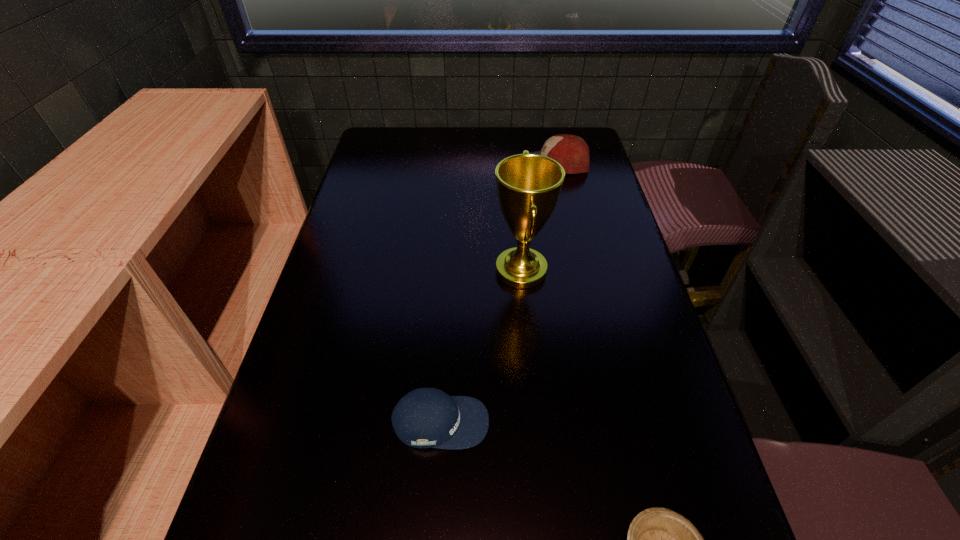
Locate an element on the screen. award is located at coordinates (528, 185).

Find the location of a particular element. Image resolution: width=960 pixels, height=540 pixels. the third nearest object is located at coordinates (528, 185).

The image size is (960, 540). What are the coordinates of `the right baseball cap` in the screenshot? It's located at (570, 151).

I want to click on the taller baseball cap, so click(x=570, y=151).

Where is `the shorter baseball cap`? This screenshot has width=960, height=540. the shorter baseball cap is located at coordinates (425, 417).

Find the location of a particular element. This screenshot has height=540, width=960. the nearer baseball cap is located at coordinates (425, 417).

Find the location of `vacant space located by the handles of the tallest object`. vacant space located by the handles of the tallest object is located at coordinates (409, 271).

Where is `vacant space situated 0.310m by the handles of the tallest object`? The width and height of the screenshot is (960, 540). vacant space situated 0.310m by the handles of the tallest object is located at coordinates (374, 271).

Find the location of a particular element. vacant region located 0.190m by the handles of the tallest object is located at coordinates (420, 271).

The image size is (960, 540). I want to click on free point located 0.180m on the front-facing side of the right baseball cap, so click(x=467, y=164).